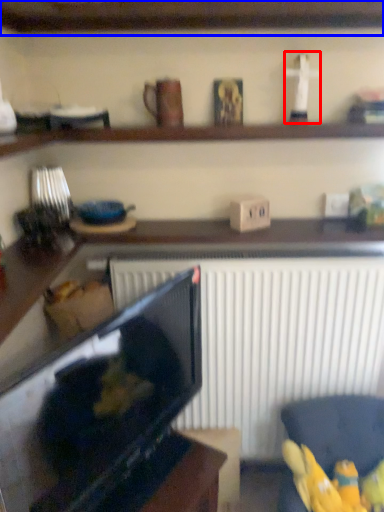
Question: Which object is further to the camera taking this photo, toy (highlighted by a red box) or shelf (highlighted by a blue box)?

Choices:
 (A) toy
 (B) shelf

Answer: (A)